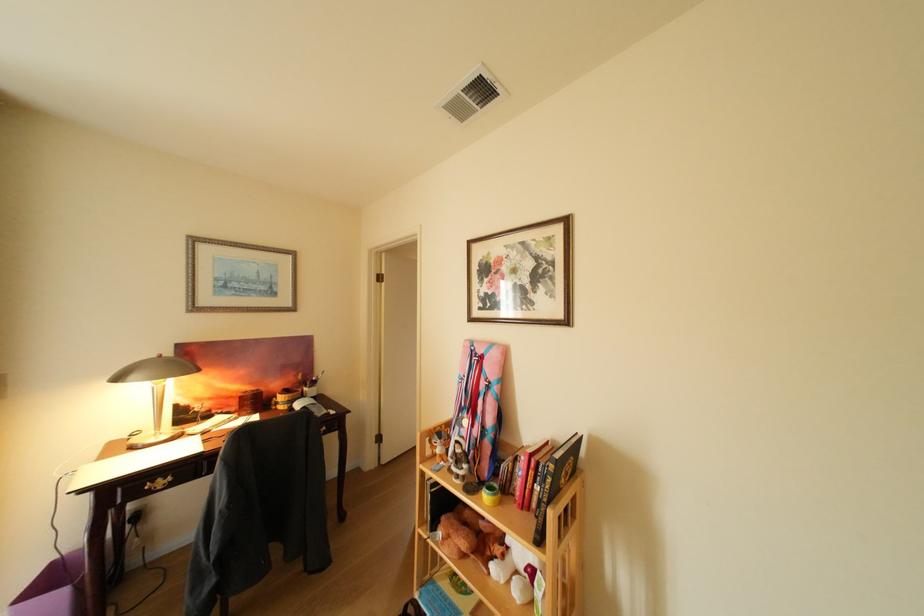
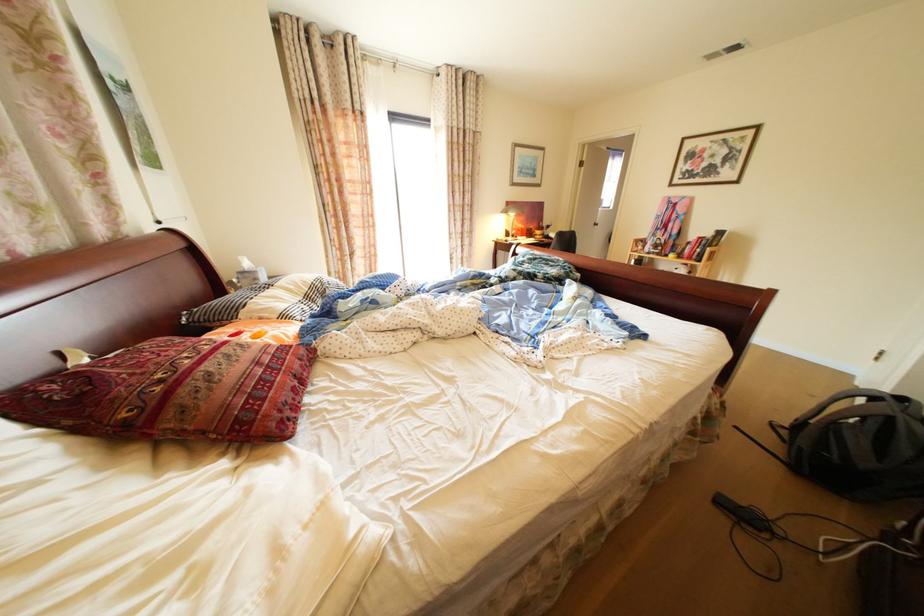
What movement of the cameraman would produce the second image?

The movement direction of the cameraman is left, backward.